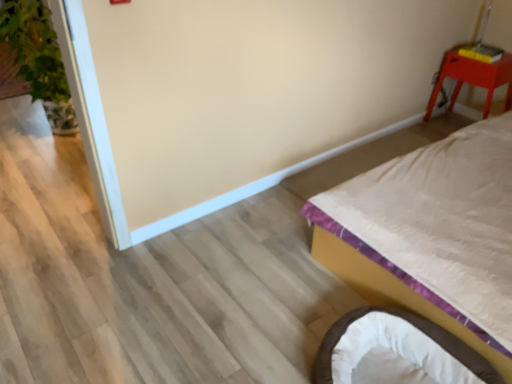
Question: Considering the relative sizes of matte red stool at upper right and white satin bed at right in the image provided, is matte red stool at upper right smaller than white satin bed at right?

Choices:
 (A) no
 (B) yes

Answer: (B)

Question: From the image's perspective, would you say matte red stool at upper right is shown under white satin bed at right?

Choices:
 (A) yes
 (B) no

Answer: (B)

Question: Is matte red stool at upper right far away from white satin bed at right?

Choices:
 (A) yes
 (B) no

Answer: (A)

Question: Does matte red stool at upper right have a greater height compared to white satin bed at right?

Choices:
 (A) no
 (B) yes

Answer: (A)

Question: Does matte red stool at upper right come behind white satin bed at right?

Choices:
 (A) no
 (B) yes

Answer: (B)

Question: Considering the relative positions of white satin bed at right and soft white fabric infant bed at lower right in the image provided, is white satin bed at right to the left or to the right of soft white fabric infant bed at lower right?

Choices:
 (A) right
 (B) left

Answer: (A)

Question: Is white satin bed at right in front of or behind soft white fabric infant bed at lower right in the image?

Choices:
 (A) front
 (B) behind

Answer: (A)

Question: Is white satin bed at right taller or shorter than soft white fabric infant bed at lower right?

Choices:
 (A) short
 (B) tall

Answer: (B)

Question: From a real-world perspective, is white satin bed at right physically located above or below soft white fabric infant bed at lower right?

Choices:
 (A) above
 (B) below

Answer: (A)

Question: Looking at the image, does green leafy plant at left seem bigger or smaller compared to matte red stool at upper right?

Choices:
 (A) small
 (B) big

Answer: (B)

Question: From a real-world perspective, is green leafy plant at left above or below matte red stool at upper right?

Choices:
 (A) below
 (B) above

Answer: (B)

Question: Would you say green leafy plant at left is inside or outside matte red stool at upper right?

Choices:
 (A) inside
 (B) outside

Answer: (B)

Question: Visually, is green leafy plant at left positioned to the left or to the right of matte red stool at upper right?

Choices:
 (A) left
 (B) right

Answer: (A)

Question: Is white satin bed at right in front of or behind matte red stool at upper right in the image?

Choices:
 (A) behind
 (B) front

Answer: (B)

Question: From the image's perspective, is white satin bed at right above or below matte red stool at upper right?

Choices:
 (A) below
 (B) above

Answer: (A)